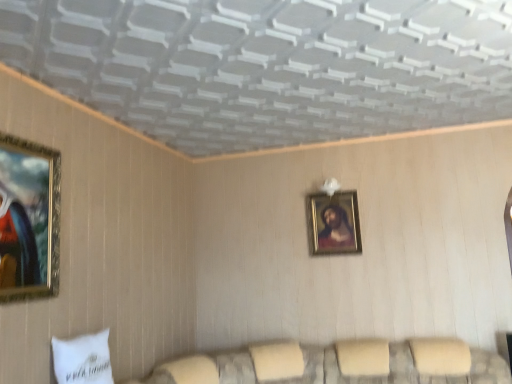
Question: From their relative heights in the image, would you say gold-framed portrait at center, which ranks as the second picture frame in left-to-right order, is taller or shorter than velvet beige couch at lower center?

Choices:
 (A) short
 (B) tall

Answer: (B)

Question: From the image's perspective, relative to velvet beige couch at lower center, is gold-framed portrait at center, the first picture frame in the back-to-front sequence, above or below?

Choices:
 (A) below
 (B) above

Answer: (B)

Question: Which object is positioned farthest from the gold-framed painting at left, which appears as the 2th picture frame when viewed from the right?

Choices:
 (A) gold-framed portrait at center, the first picture frame when ordered from right to left
 (B) velvet beige couch at lower center
 (C) white fabric pillow at lower left

Answer: (A)

Question: Which object is positioned closest to the white fabric pillow at lower left?

Choices:
 (A) velvet beige couch at lower center
 (B) gold-framed painting at left, the 1th picture frame when ordered from left to right
 (C) gold-framed portrait at center, the first picture frame when ordered from right to left

Answer: (B)